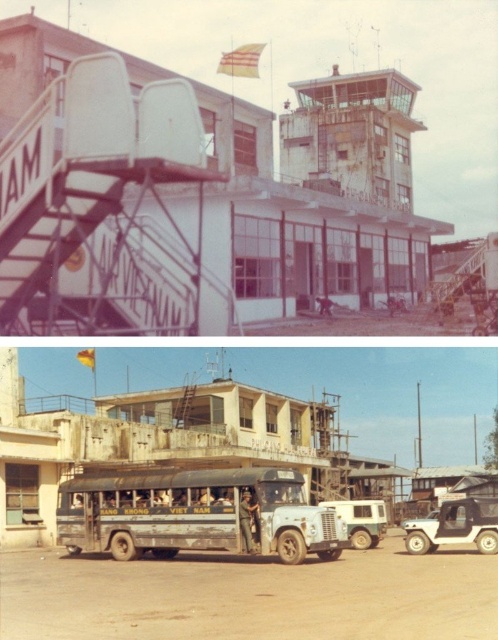
Question: Can you confirm if brown dusty ground at lower center is positioned below white matte van at center?

Choices:
 (A) yes
 (B) no

Answer: (B)

Question: Is brown dusty ground at lower center behind white matte jeep at lower right?

Choices:
 (A) yes
 (B) no

Answer: (B)

Question: Among these objects, which one is farthest from the camera?

Choices:
 (A) dirty green bus at center
 (B) white matte jeep at lower right

Answer: (B)

Question: Is brown dusty ground at lower center further to camera compared to white matte van at center?

Choices:
 (A) yes
 (B) no

Answer: (B)

Question: Which point is closer to the camera taking this photo?

Choices:
 (A) (252, 531)
 (B) (411, 544)
 (C) (373, 516)

Answer: (A)

Question: Which object appears closest to the camera in this image?

Choices:
 (A) brown dusty ground at lower center
 (B) dirty green bus at center
 (C) white matte jeep at lower right
 (D) white matte van at center

Answer: (A)